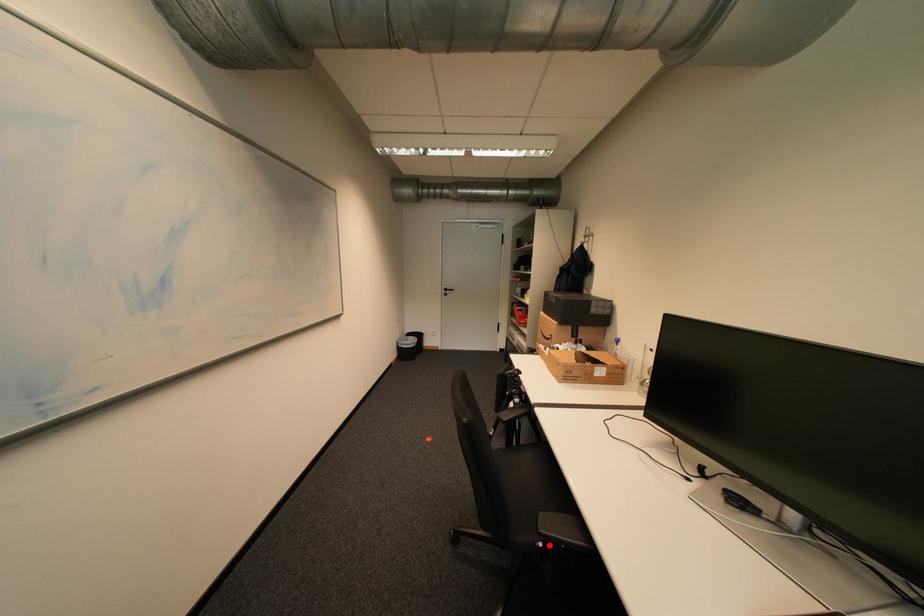
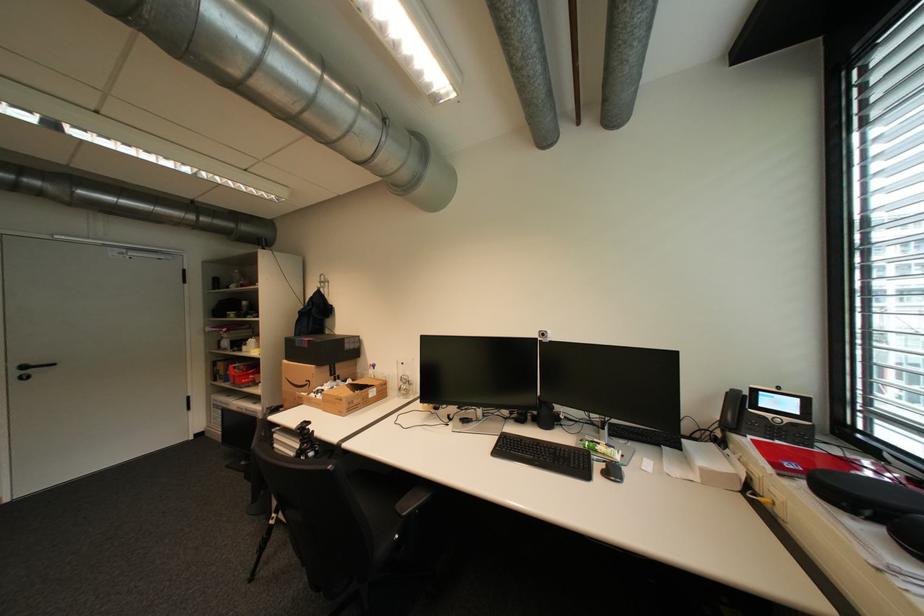
The point at the highlighted location is marked in the first image. Where is the corresponding point in the second image?

(406, 537)